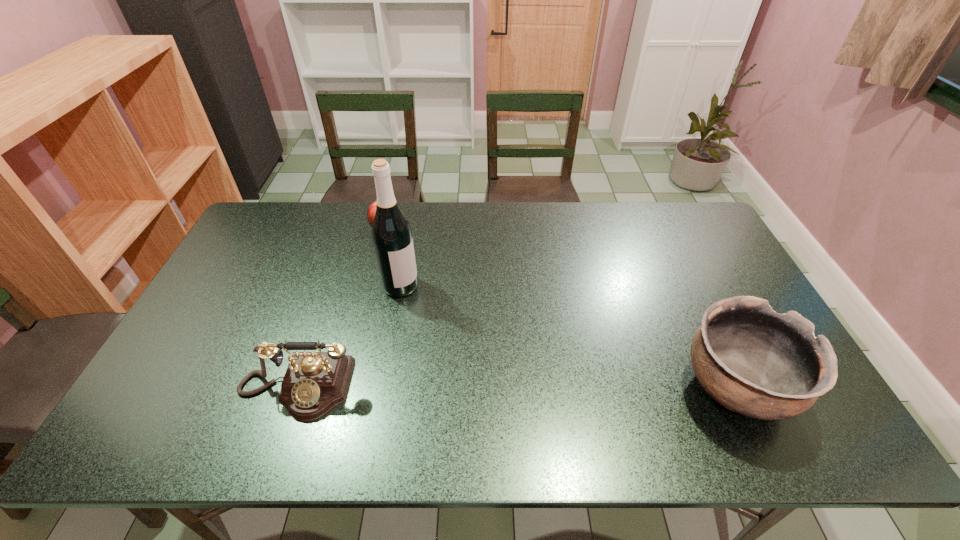
Where is `vacant space that's between the rightmost object and the shortest object`? vacant space that's between the rightmost object and the shortest object is located at coordinates [x=561, y=309].

This screenshot has height=540, width=960. In order to click on vacant space that is in between the third tallest object and the farthest object in this screenshot , I will do `click(342, 309)`.

Select which object is the second closest to the apple. Please provide its 2D coordinates. Your answer should be formatted as a tuple, i.e. [(x, y)], where the tuple contains the x and y coordinates of a point satisfying the conditions above.

[(314, 383)]

This screenshot has width=960, height=540. I want to click on object that stands as the third closest to the pottery, so click(x=371, y=211).

Locate an element on the screen. The height and width of the screenshot is (540, 960). free location that satisfies the following two spatial constraints: 1. on the front side of the pottery; 2. on the left side of the third nearest object is located at coordinates coord(382,388).